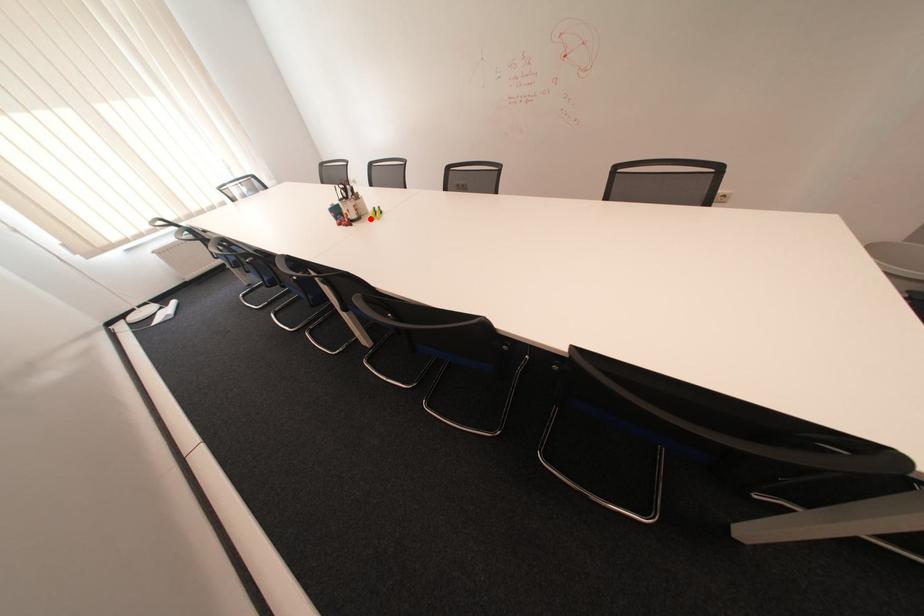
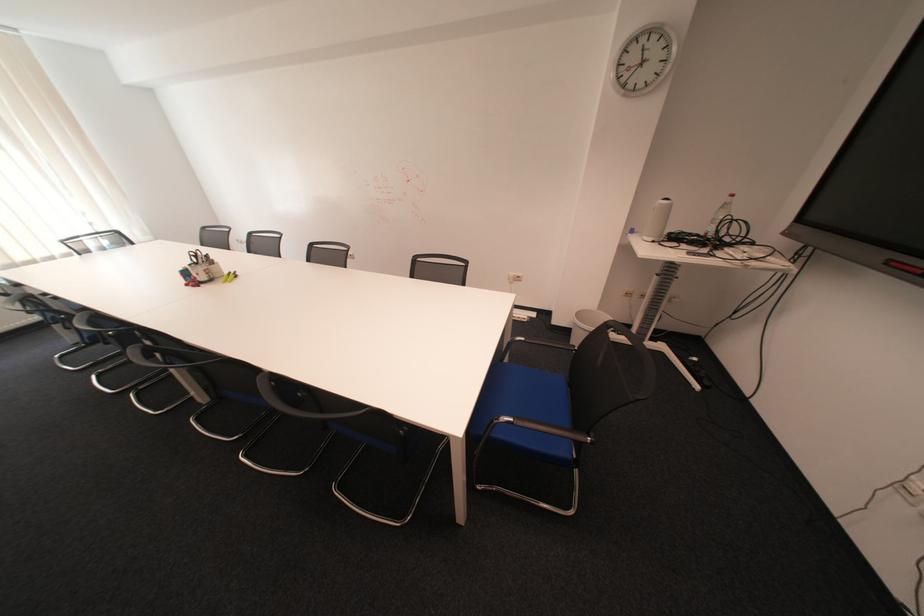
Where in the second image is the point corresponding to the highlighted location from the first image?

(223, 281)